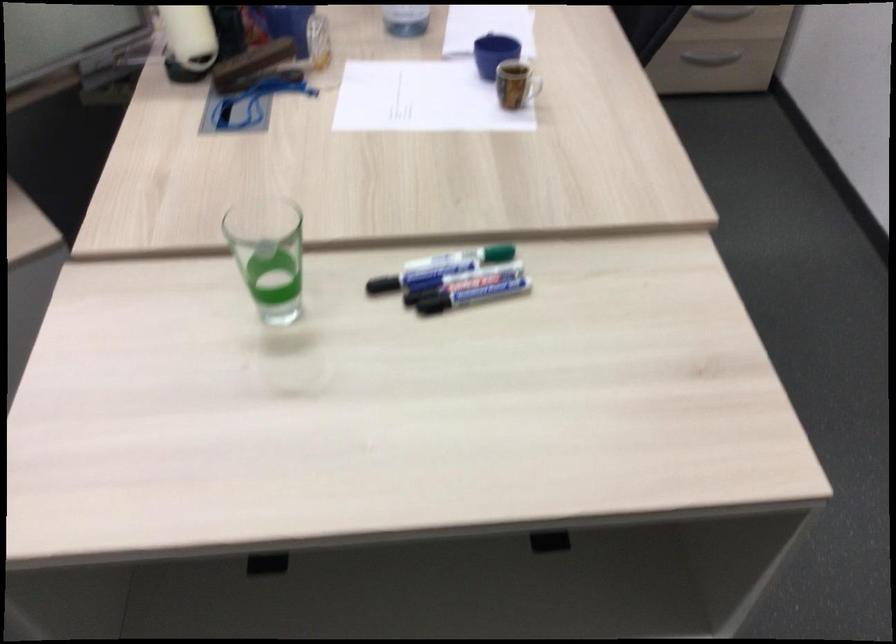
What are the coordinates of `black marker pen` in the screenshot? It's located at (470, 296).